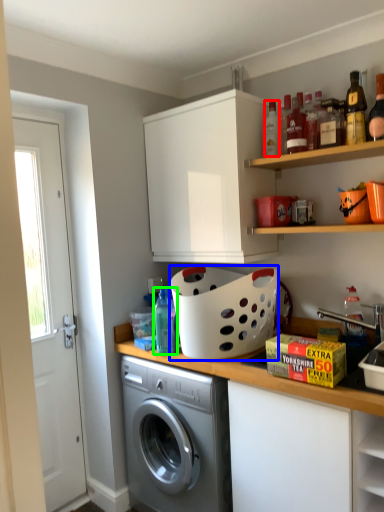
Question: Which is nearer to the bottle (highlighted by a red box)? basket (highlighted by a blue box) or bottle (highlighted by a green box).

Choices:
 (A) basket
 (B) bottle

Answer: (A)